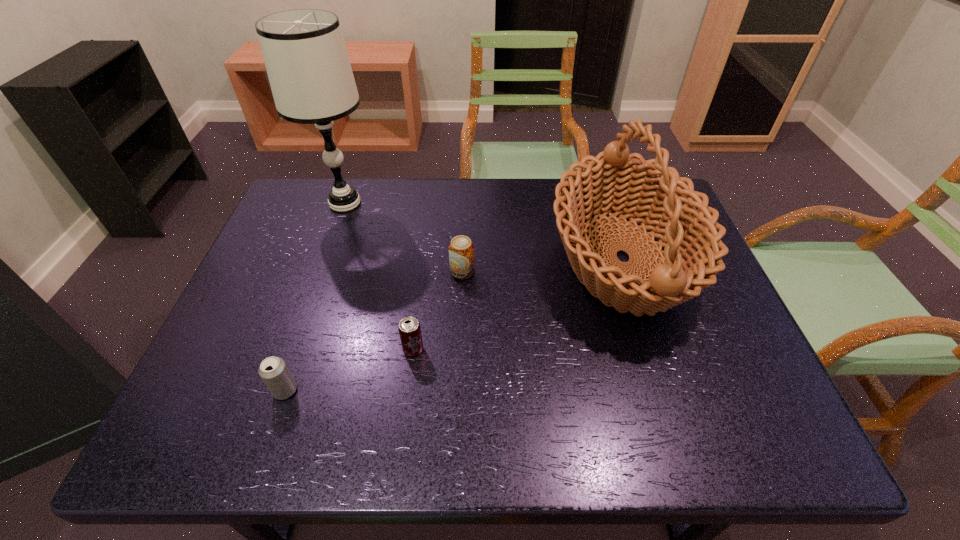
At what (x,y) coordinates should I click in order to perform the action: click on blank area located on the front of the second tallest object. Please return your answer as a coordinate pair (x, y). Looking at the image, I should click on (x=678, y=433).

At what (x,y) coordinates should I click in order to perform the action: click on free region located on the front of the rightmost beer can. Please return your answer as a coordinate pair (x, y). Looking at the image, I should click on point(460,338).

Locate an element on the screen. blank area located on the right of the leftmost beer can is located at coordinates tap(394, 390).

At what (x,y) coordinates should I click in order to perform the action: click on free region located 0.110m on the back of the second farthest beer can. Please return your answer as a coordinate pair (x, y). Image resolution: width=960 pixels, height=540 pixels. Looking at the image, I should click on (419, 304).

This screenshot has height=540, width=960. I want to click on table lamp that is at the far edge, so click(x=304, y=52).

In order to click on basket that is at the far edge in this screenshot , I will do `click(652, 193)`.

This screenshot has height=540, width=960. In order to click on object that is at the left edge in this screenshot , I will do `click(304, 52)`.

Identify the location of object present at the right edge. (652, 193).

The height and width of the screenshot is (540, 960). Find the location of `object at the far left corner`. object at the far left corner is located at coordinates (304, 52).

Locate an element on the screen. The height and width of the screenshot is (540, 960). object that is at the far right corner is located at coordinates (652, 193).